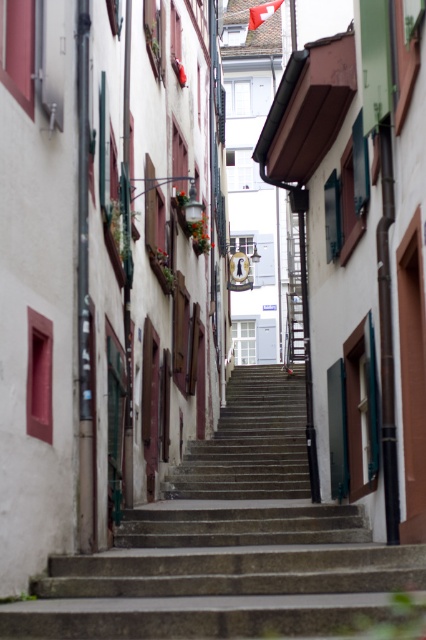
You are a tourist standing at the bottom of the concrete stairs at center. You notice a red fabric flag at upper center. Which object is taller from your perspective?

The red fabric flag at upper center is taller than the concrete stairs at center from your perspective.